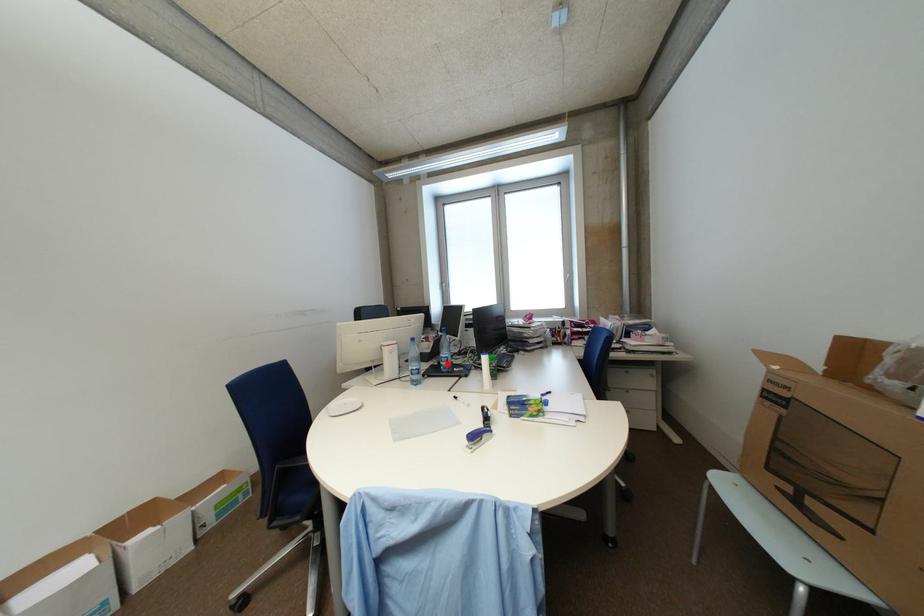
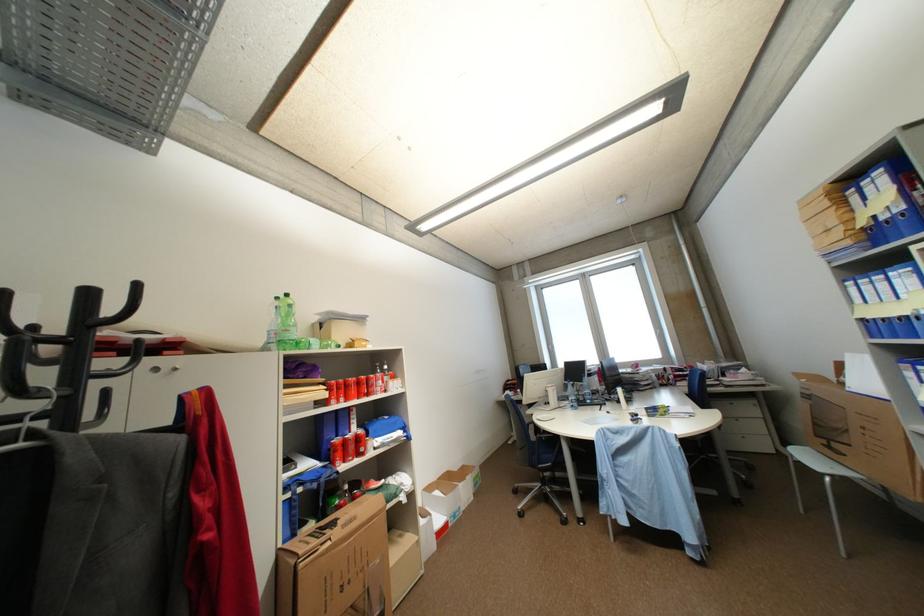
Find the pixel in the second image that matches the highlighted location in the first image.

(587, 400)